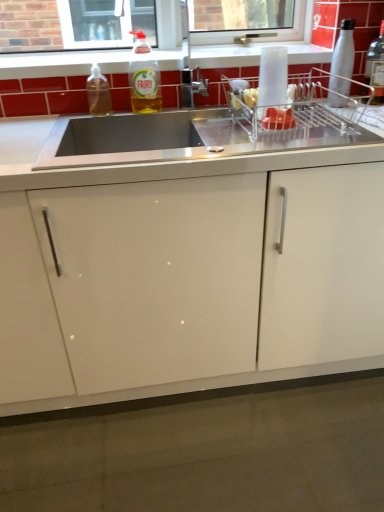
Locate an element on the screen. Image resolution: width=384 pixels, height=512 pixels. translucent plastic soap dispenser at upper left, arranged as the 1th bottle when viewed from the left is located at coordinates (98, 92).

What are the coordinates of `stainless steel sink at center` in the screenshot? It's located at (167, 148).

Find the location of a particular element. The height and width of the screenshot is (512, 384). translucent plastic bottle at upper center, which is the 3th bottle from right to left is located at coordinates (144, 78).

This screenshot has height=512, width=384. In order to click on translucent plastic soap dispenser at upper left, which appears as the 4th bottle when viewed from the right in this screenshot , I will do pos(98,92).

Between metallic silver dish rack at upper right and white glossy cabinet at center, which one is positioned in front?

white glossy cabinet at center is in front.

From the image's perspective, is metallic silver dish rack at upper right above white glossy cabinet at center?

Yes, from the image's perspective, metallic silver dish rack at upper right is over white glossy cabinet at center.

Which object is wider, metallic silver dish rack at upper right or white glossy cabinet at center?

white glossy cabinet at center is wider.

Is white glossy cabinet at center closer to camera compared to clear glass bottle at upper right, which appears as the 1th bottle when viewed from the right?

Yes.

Based on the photo, considering the relative sizes of white glossy cabinet at center and clear glass bottle at upper right, which appears as the 1th bottle when viewed from the right, in the image provided, is white glossy cabinet at center thinner than clear glass bottle at upper right, which appears as the 1th bottle when viewed from the right,?

No, white glossy cabinet at center is not thinner than clear glass bottle at upper right, which appears as the 1th bottle when viewed from the right.

Do you think white glossy cabinet at center is within clear glass bottle at upper right, acting as the 4th bottle starting from the left, or outside of it?

white glossy cabinet at center is not inside clear glass bottle at upper right, acting as the 4th bottle starting from the left, it's outside.

Locate an element on the screen. Image resolution: width=384 pixels, height=512 pixels. the 3rd bottle to the right when counting from the translucent plastic soap dispenser at upper left, arranged as the 1th bottle when viewed from the left is located at coordinates (376, 66).

From the image's perspective, is translucent plastic soap dispenser at upper left, which appears as the 4th bottle when viewed from the right, under clear glass bottle at upper right, acting as the 4th bottle starting from the left?

Yes.

Is point (105, 86) in front of point (368, 70)?

Yes.

From a real-world perspective, is translucent plastic soap dispenser at upper left, arranged as the 1th bottle when viewed from the left, positioned under clear glass bottle at upper right, acting as the 4th bottle starting from the left, based on gravity?

Yes, from a real-world perspective, translucent plastic soap dispenser at upper left, arranged as the 1th bottle when viewed from the left, is below clear glass bottle at upper right, acting as the 4th bottle starting from the left.

From the image's perspective, between stainless steel sink at center and translucent plastic bottle at upper center, marked as the 2th bottle in a left-to-right arrangement, who is located below?

translucent plastic bottle at upper center, marked as the 2th bottle in a left-to-right arrangement.

Which of these two, stainless steel sink at center or translucent plastic bottle at upper center, marked as the 2th bottle in a left-to-right arrangement, is smaller?

translucent plastic bottle at upper center, marked as the 2th bottle in a left-to-right arrangement.

Relative to translucent plastic bottle at upper center, which is the 3th bottle from right to left, is stainless steel sink at center in front or behind?

Clearly, stainless steel sink at center is in front of translucent plastic bottle at upper center, which is the 3th bottle from right to left.

Is translucent plastic bottle at upper center, which is the 3th bottle from right to left, surrounded by stainless steel sink at center?

No.

Is translucent plastic soap dispenser at upper left, arranged as the 1th bottle when viewed from the left, with silver metallic bottle at upper right, which is the third bottle in left-to-right order?

They are not placed beside each other.

Do you think translucent plastic soap dispenser at upper left, arranged as the 1th bottle when viewed from the left, is within silver metallic bottle at upper right, which is the third bottle in left-to-right order, or outside of it?

translucent plastic soap dispenser at upper left, arranged as the 1th bottle when viewed from the left, lies outside silver metallic bottle at upper right, which is the third bottle in left-to-right order.

Is translucent plastic soap dispenser at upper left, arranged as the 1th bottle when viewed from the left, bigger or smaller than silver metallic bottle at upper right, which is the third bottle in left-to-right order?

Clearly, translucent plastic soap dispenser at upper left, arranged as the 1th bottle when viewed from the left, is larger in size than silver metallic bottle at upper right, which is the third bottle in left-to-right order.

Where is `the 2nd bottle located beneath the silver metallic bottle at upper right, the second bottle from the right (from a real-world perspective)`? the 2nd bottle located beneath the silver metallic bottle at upper right, the second bottle from the right (from a real-world perspective) is located at coordinates (x=98, y=92).

From the image's perspective, which object appears higher, white glossy cabinet at center or stainless steel sink at center?

From the image's view, stainless steel sink at center is above.

Is white glossy cabinet at center touching stainless steel sink at center?

white glossy cabinet at center and stainless steel sink at center are not in contact.

Does white glossy cabinet at center appear on the left side of stainless steel sink at center?

No.

At what (x,y) coordinates should I click in order to perform the action: click on cabinetry that is under the stainless steel sink at center (from a real-world perspective). Please return your answer as a coordinate pair (x, y). Looking at the image, I should click on (195, 284).

From a real-world perspective, is white glossy window sill at upper center on translucent plastic bottle at upper center, marked as the 2th bottle in a left-to-right arrangement?

Yes, from a real-world perspective, white glossy window sill at upper center is over translucent plastic bottle at upper center, marked as the 2th bottle in a left-to-right arrangement

From the image's perspective, count 2nd bottles downward from the white glossy window sill at upper center and point to it. Please provide its 2D coordinates.

[(144, 78)]

Could you tell me if white glossy window sill at upper center is facing translucent plastic bottle at upper center, which is the 3th bottle from right to left?

Yes, white glossy window sill at upper center is turned towards translucent plastic bottle at upper center, which is the 3th bottle from right to left.

How much distance is there between white glossy window sill at upper center and translucent plastic bottle at upper center, which is the 3th bottle from right to left?

A distance of 7.45 inches exists between white glossy window sill at upper center and translucent plastic bottle at upper center, which is the 3th bottle from right to left.

This screenshot has height=512, width=384. In order to click on appliance located on the right of white glossy cabinet at center in this screenshot , I will do `click(297, 105)`.

Locate an element on the screen. cabinetry that is below the clear glass bottle at upper right, acting as the 4th bottle starting from the left (from the image's perspective) is located at coordinates (195, 284).

Estimate the real-world distances between objects in this image. Which object is further from clear glass bottle at upper right, which appears as the 1th bottle when viewed from the right, white glossy cabinet at center or white glossy window sill at upper center?

Based on the image, white glossy cabinet at center appears to be further to clear glass bottle at upper right, which appears as the 1th bottle when viewed from the right.

Based on their spatial positions, is clear glass bottle at upper right, which appears as the 1th bottle when viewed from the right, or stainless steel sink at center closer to stainless steel sink at center?

Among the two, stainless steel sink at center is located nearer to stainless steel sink at center.

Looking at this image, from the image, which object appears to be nearer to white glossy cabinet at center, clear glass bottle at upper right, acting as the 4th bottle starting from the left, or stainless steel sink at center?

stainless steel sink at center lies closer to white glossy cabinet at center than the other object.

Considering their positions, is clear glass bottle at upper right, acting as the 4th bottle starting from the left, positioned closer to metallic silver dish rack at upper right than white glossy cabinet at center?

Based on the image, clear glass bottle at upper right, acting as the 4th bottle starting from the left, appears to be nearer to metallic silver dish rack at upper right.

Estimate the real-world distances between objects in this image. Which object is closer to metallic silver dish rack at upper right, silver metallic bottle at upper right, the second bottle from the right, or stainless steel sink at center?

Among the two, stainless steel sink at center is located nearer to metallic silver dish rack at upper right.

Based on their spatial positions, is white glossy cabinet at center or clear glass bottle at upper right, which appears as the 1th bottle when viewed from the right, closer to silver metallic bottle at upper right, the second bottle from the right?

clear glass bottle at upper right, which appears as the 1th bottle when viewed from the right, is positioned closer to the anchor silver metallic bottle at upper right, the second bottle from the right.

Which object lies further to the anchor point white glossy window sill at upper center, translucent plastic bottle at upper center, marked as the 2th bottle in a left-to-right arrangement, or clear glass bottle at upper right, acting as the 4th bottle starting from the left?

clear glass bottle at upper right, acting as the 4th bottle starting from the left.

Which object lies further to the anchor point silver metallic bottle at upper right, the second bottle from the right, metallic silver dish rack at upper right or translucent plastic bottle at upper center, marked as the 2th bottle in a left-to-right arrangement?

Among the two, translucent plastic bottle at upper center, marked as the 2th bottle in a left-to-right arrangement, is located further to silver metallic bottle at upper right, the second bottle from the right.

Image resolution: width=384 pixels, height=512 pixels. I want to click on appliance located between stainless steel sink at center and silver metallic bottle at upper right, which is the third bottle in left-to-right order, in the left-right direction, so click(297, 105).

What are the coordinates of `appliance between clear glass bottle at upper right, acting as the 4th bottle starting from the left, and white glossy cabinet at center from top to bottom` in the screenshot? It's located at (297, 105).

Where is `appliance that lies between silver metallic bottle at upper right, the second bottle from the right, and white glossy cabinet at center from top to bottom`? appliance that lies between silver metallic bottle at upper right, the second bottle from the right, and white glossy cabinet at center from top to bottom is located at coordinates (297, 105).

Image resolution: width=384 pixels, height=512 pixels. Identify the location of bottle situated between white glossy window sill at upper center and clear glass bottle at upper right, acting as the 4th bottle starting from the left, from left to right. (342, 65).